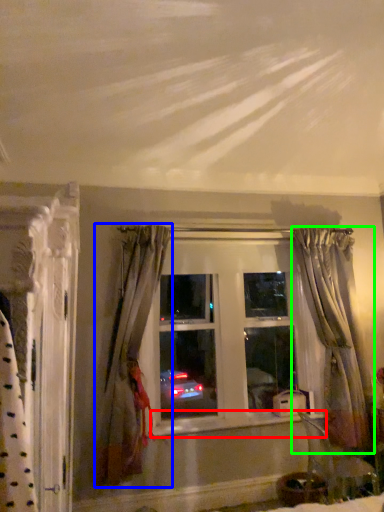
Question: Based on their relative distances, which object is farther from window sill (highlighted by a red box)? Choose from curtain (highlighted by a blue box) and curtain (highlighted by a green box).

Choices:
 (A) curtain
 (B) curtain

Answer: (B)